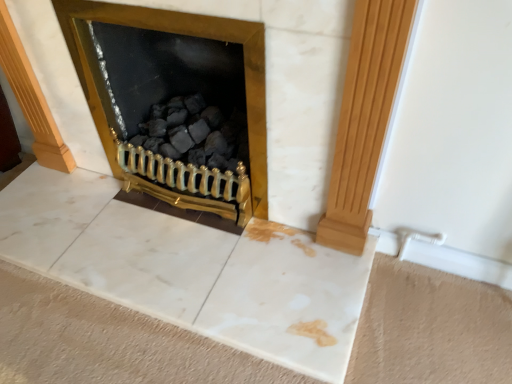
Question: Choose the correct answer: Is gold metallic fireplace at center inside light brown wood pillar at right or outside it?

Choices:
 (A) inside
 (B) outside

Answer: (B)

Question: Is gold metallic fireplace at center wider or thinner than light brown wood pillar at right?

Choices:
 (A) wide
 (B) thin

Answer: (A)

Question: Would you say gold metallic fireplace at center is to the left or to the right of light brown wood pillar at right in the picture?

Choices:
 (A) right
 (B) left

Answer: (B)

Question: From a real-world perspective, relative to gold metallic fireplace at center, is light brown wood pillar at right vertically above or below?

Choices:
 (A) below
 (B) above

Answer: (B)

Question: In the image, is light brown wood pillar at right on the left side or the right side of gold metallic fireplace at center?

Choices:
 (A) left
 (B) right

Answer: (B)

Question: In terms of height, does light brown wood pillar at right look taller or shorter compared to gold metallic fireplace at center?

Choices:
 (A) short
 (B) tall

Answer: (B)

Question: Is light brown wood pillar at right inside the boundaries of gold metallic fireplace at center, or outside?

Choices:
 (A) outside
 (B) inside

Answer: (A)